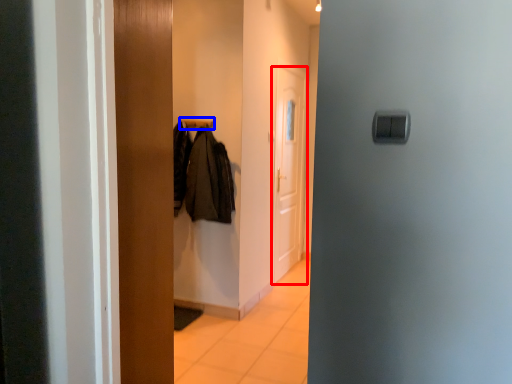
Question: Which object is closer to the camera taking this photo, door (highlighted by a red box) or hanger (highlighted by a blue box)?

Choices:
 (A) door
 (B) hanger

Answer: (B)